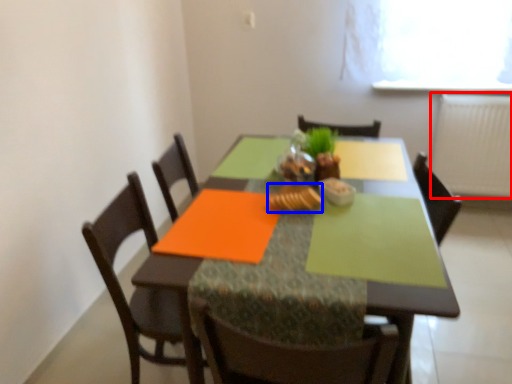
Question: Which of the following is the farthest to the observer, radiator (highlighted by a red box) or food (highlighted by a blue box)?

Choices:
 (A) radiator
 (B) food

Answer: (A)